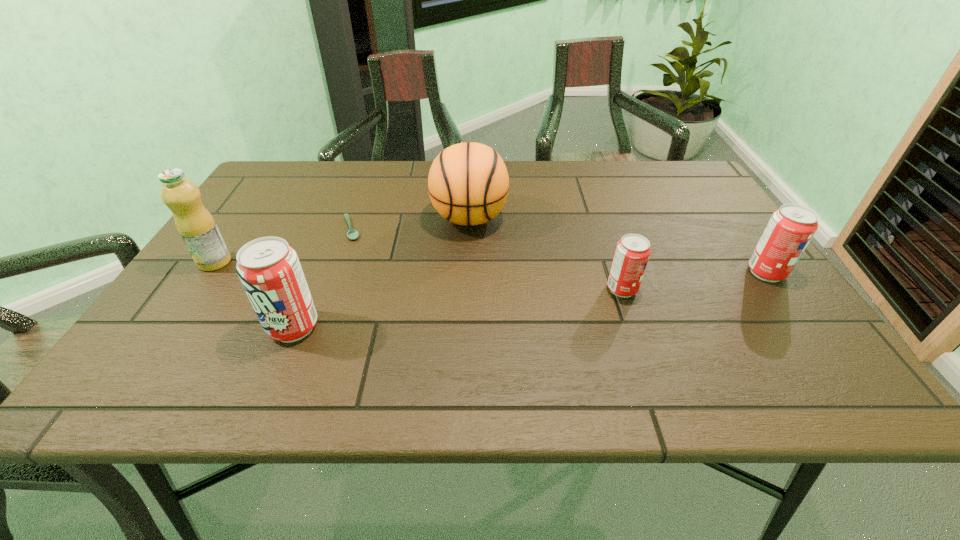
Find the location of a particular element. The width and height of the screenshot is (960, 540). free space for an extra pop_(soda) to achieve even spacing is located at coordinates (465, 307).